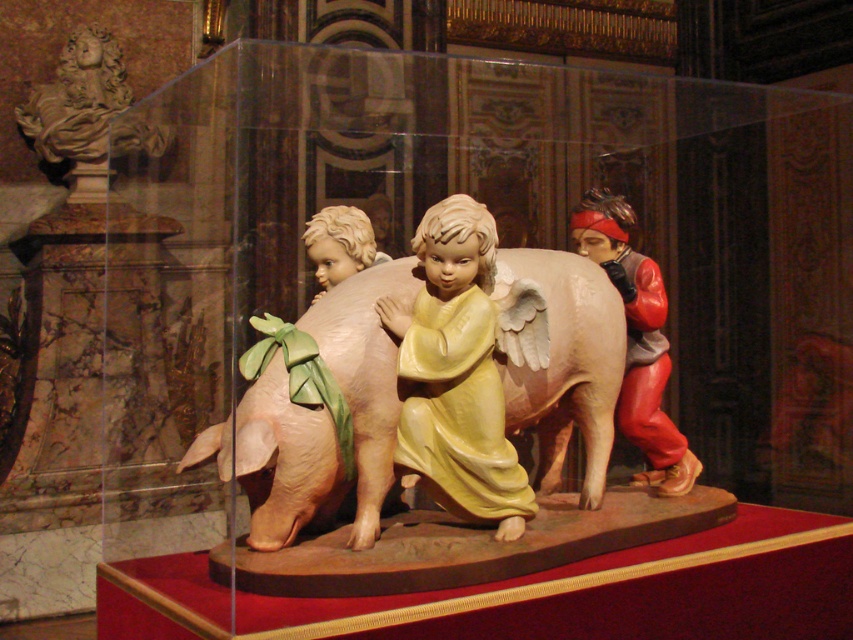
Is matte yellow angel at center shorter than smooth beige pig at center?

Incorrect, matte yellow angel at center's height does not fall short of smooth beige pig at center's.

Which is more to the right, matte yellow angel at center or smooth beige pig at center?

matte yellow angel at center is more to the right.

Who is more distant from viewer, (447, 230) or (320, 292)?

Positioned behind is point (320, 292).

This screenshot has width=853, height=640. I want to click on matte yellow angel at center, so click(456, 374).

Can you confirm if matte pink pig at center is positioned below smooth beige pig at center?

Correct, matte pink pig at center is located below smooth beige pig at center.

Which is more to the left, matte pink pig at center or smooth beige pig at center?

From the viewer's perspective, smooth beige pig at center appears more on the left side.

What do you see at coordinates (567, 364) in the screenshot? The image size is (853, 640). I see `matte pink pig at center` at bounding box center [567, 364].

Where is `matte pink pig at center`? matte pink pig at center is located at coordinates (567, 364).

Is matte yellow angel at center thinner than matte red cloth at right?

No.

Is matte yellow angel at center wider than matte red cloth at right?

Indeed, matte yellow angel at center has a greater width compared to matte red cloth at right.

Describe the element at coordinates (456, 374) in the screenshot. I see `matte yellow angel at center` at that location.

At what (x,y) coordinates should I click in order to perform the action: click on matte yellow angel at center. Please return your answer as a coordinate pair (x, y). This screenshot has width=853, height=640. Looking at the image, I should click on (456, 374).